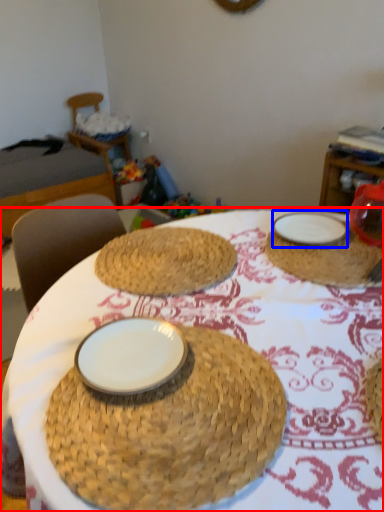
Question: Which of the following is the closest to the observer, table (highlighted by a red box) or plate (highlighted by a blue box)?

Choices:
 (A) table
 (B) plate

Answer: (A)